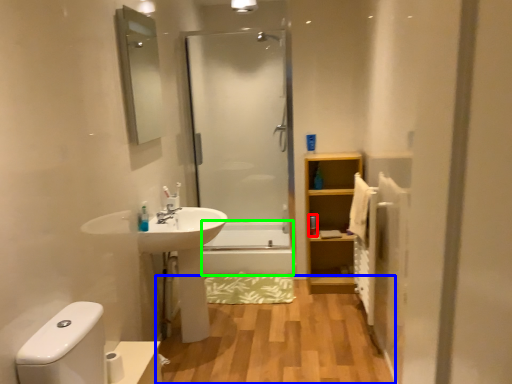
Question: Based on their relative distances, which object is nearer to toiletry (highlighted by a red box)? Choose from hardwood (highlighted by a blue box) and bath (highlighted by a green box).

Choices:
 (A) hardwood
 (B) bath

Answer: (B)